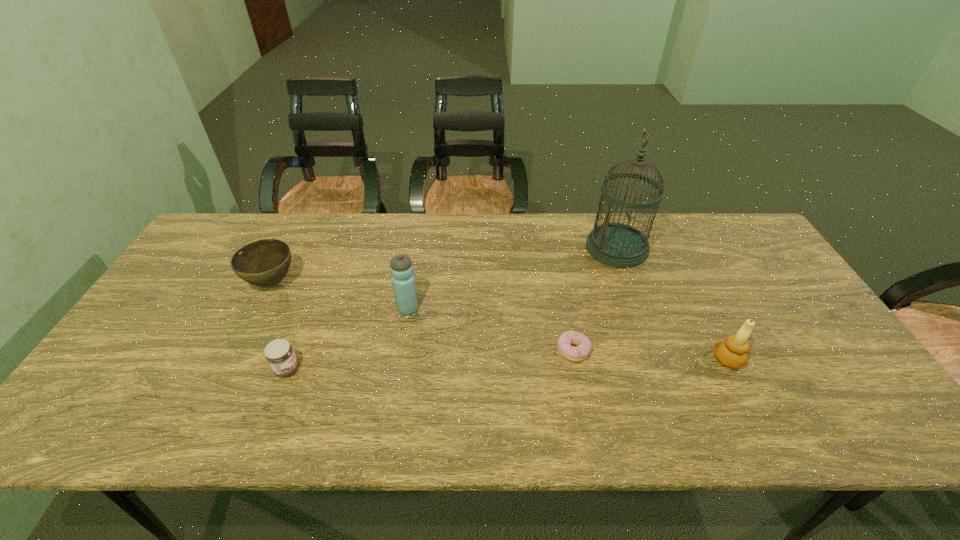
Where is `free space between the fifth shortest object and the fifth object from right to left`? The height and width of the screenshot is (540, 960). free space between the fifth shortest object and the fifth object from right to left is located at coordinates (348, 339).

The width and height of the screenshot is (960, 540). I want to click on free space between the fifth tallest object and the bowl, so [279, 326].

The image size is (960, 540). Identify the location of vacant space that's between the bowl and the third object from left to right. (340, 296).

Find the location of `empty space between the fourth object from right to left and the doughnut`. empty space between the fourth object from right to left and the doughnut is located at coordinates (491, 330).

Locate an element on the screen. vacant space that's between the second object from right to left and the leftmost object is located at coordinates (444, 266).

The width and height of the screenshot is (960, 540). I want to click on empty space between the third tallest object and the bowl, so click(500, 321).

Where is `object that is the fifth closest to the second object from left to right`? Image resolution: width=960 pixels, height=540 pixels. object that is the fifth closest to the second object from left to right is located at coordinates (733, 353).

Identify which object is the third closest to the third shortest object. Please provide its 2D coordinates. Your answer should be formatted as a tuple, i.e. [(x, y)], where the tuple contains the x and y coordinates of a point satisfying the conditions above.

[(579, 353)]

Where is `vacant point that satisfies the following two spatial constraints: 1. on the front-facing side of the rightmost object; 2. on the left side of the birdcage`? This screenshot has height=540, width=960. vacant point that satisfies the following two spatial constraints: 1. on the front-facing side of the rightmost object; 2. on the left side of the birdcage is located at coordinates (657, 360).

Where is `free spot that satisfies the following two spatial constraints: 1. on the back side of the candle_holder; 2. on the front-facing side of the fifth object from left to right`? free spot that satisfies the following two spatial constraints: 1. on the back side of the candle_holder; 2. on the front-facing side of the fifth object from left to right is located at coordinates (672, 248).